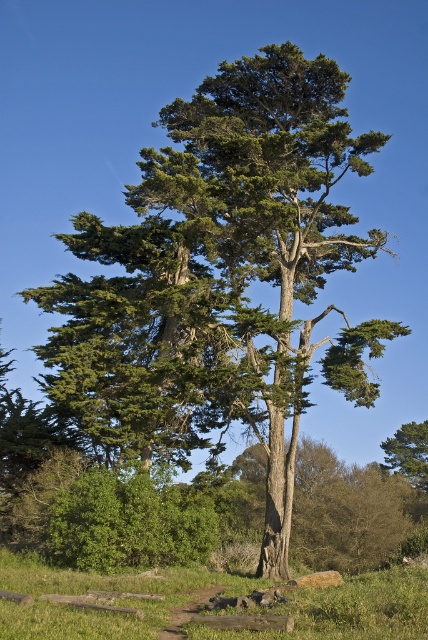
Question: From the image, what is the correct spatial relationship of green grass at lower center in relation to green rough bark tree at lower right?

Choices:
 (A) below
 (B) above

Answer: (B)

Question: Which point is farther to the camera?

Choices:
 (A) green grass at lower center
 (B) green rough bark tree at lower right

Answer: (B)

Question: Is green grass at lower center bigger than green rough bark tree at lower right?

Choices:
 (A) no
 (B) yes

Answer: (B)

Question: Does green grass at lower center appear on the left side of green rough bark tree at lower right?

Choices:
 (A) yes
 (B) no

Answer: (A)

Question: Which of the following is the farthest from the observer?

Choices:
 (A) green rough bark tree at lower right
 (B) green grass at lower center

Answer: (A)